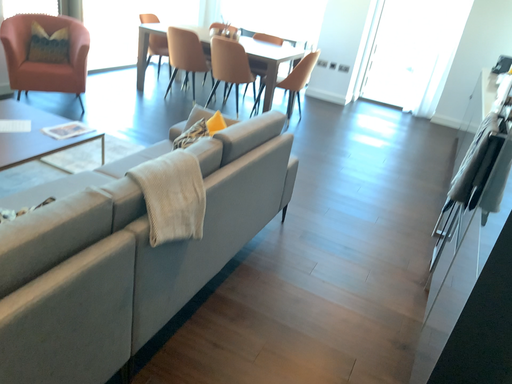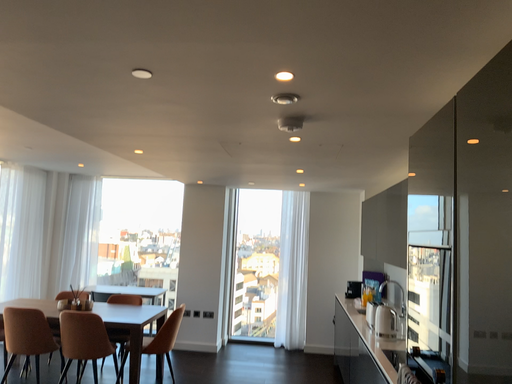
Question: How did the camera likely rotate when shooting the video?

Choices:
 (A) rotated upward
 (B) rotated downward

Answer: (A)